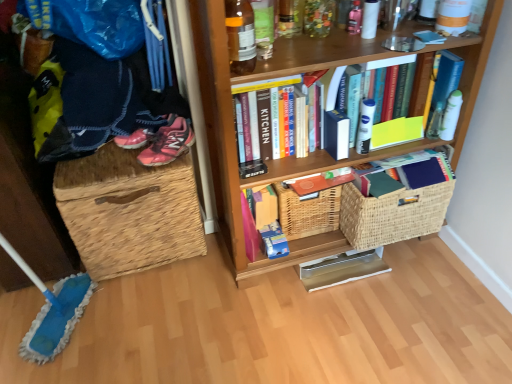
Locate an element on the screen. Image resolution: width=512 pixels, height=384 pixels. vacant space situated on the left part of metallic gold book at lower center, the first book from the bottom is located at coordinates (282, 293).